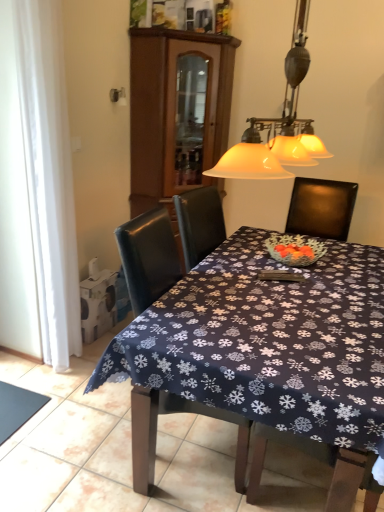
Where is `free area behind dark blue fabric at lower left`? The image size is (384, 512). free area behind dark blue fabric at lower left is located at coordinates (36, 372).